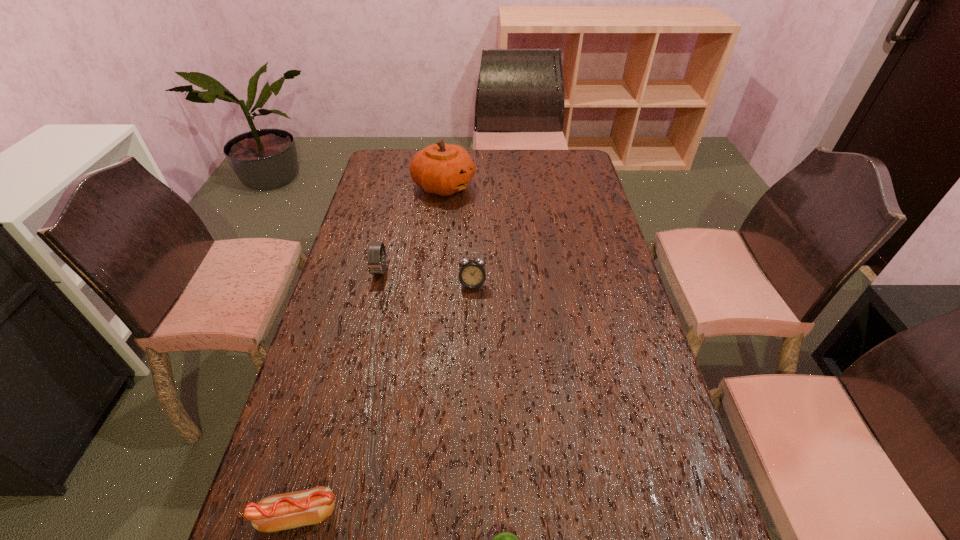
This screenshot has height=540, width=960. I want to click on object at the far edge, so click(x=442, y=169).

Where is `watch that is at the left edge`? The image size is (960, 540). watch that is at the left edge is located at coordinates (375, 262).

What are the coordinates of `sausage at the left edge` in the screenshot? It's located at (278, 512).

You are a GUI agent. You are given a task and a screenshot of the screen. Output one action in this format:
    pyautogui.click(x=<x>, y=<y>)
    Task: Click on the vacant space at the far edge of the desktop
    
    Given the screenshot: What is the action you would take?
    coord(514,151)

In the image, there is a desktop. In order to click on free space at the left edge in this screenshot , I will do `click(367, 253)`.

Image resolution: width=960 pixels, height=540 pixels. In the image, there is a desktop. Identify the location of vacant space at the right edge. (599, 247).

Locate an element on the screen. vacant area that lies between the tallest object and the shortest object is located at coordinates (x=371, y=350).

Locate an element on the screen. The width and height of the screenshot is (960, 540). free spot between the alarm clock and the shortest object is located at coordinates coord(385,400).

The image size is (960, 540). In order to click on vacant region between the alarm clock and the sausage in this screenshot , I will do `click(385, 400)`.

The image size is (960, 540). In order to click on vacant area between the watch and the shortest object in this screenshot , I will do `click(339, 393)`.